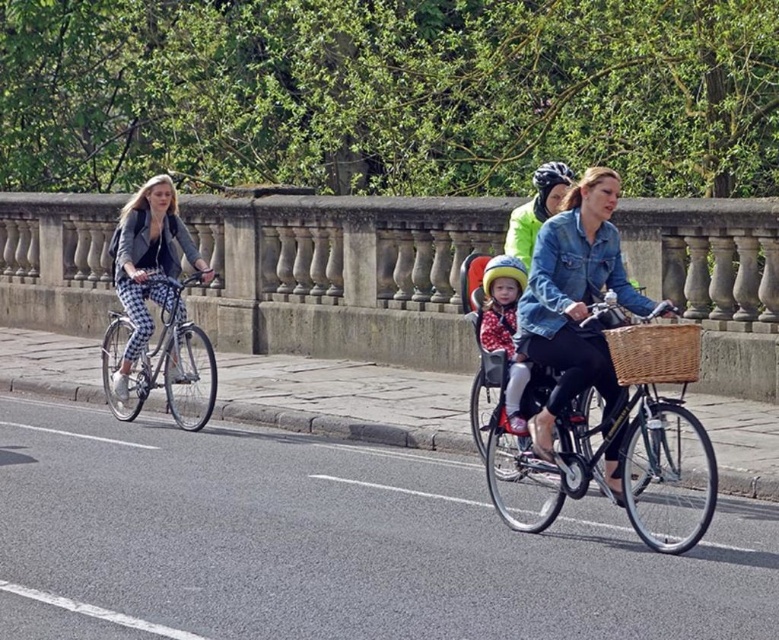
You are a pedestrian walking on the sidewalk and see the matte black jacket at left and the polka dot fabric baby carrier at center. Which object is closer to your left side?

The matte black jacket at left is closer to your left side because it is positioned to the left of the polka dot fabric baby carrier at center.

You are a pedestrian standing on the sidewalk. You see a black asphalt road at center and a denim jacket at center. Which one is closer to you?

The black asphalt road at center is closer to you because it is in front of the denim jacket at center.